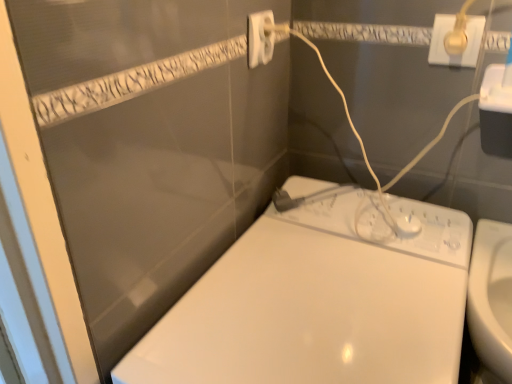
Image resolution: width=512 pixels, height=384 pixels. Describe the element at coordinates (260, 38) in the screenshot. I see `white plastic power plug at upper center, positioned as the first power plugs and sockets in left-to-right order` at that location.

Find the location of a particular element. This screenshot has height=384, width=512. gold metallic plug at upper right, which appears as the first power plugs and sockets when viewed from the right is located at coordinates (456, 40).

Which is more to the left, white glossy toilet at lower right or gold metallic plug at upper right, which is the second power plugs and sockets from left to right?

From the viewer's perspective, white glossy toilet at lower right appears more on the left side.

How many degrees apart are the facing directions of white glossy toilet at lower right and gold metallic plug at upper right, which is the second power plugs and sockets from left to right?

They differ by 10.7 degrees in their facing directions.

The image size is (512, 384). I want to click on the 1st power plugs and sockets located above the white glossy toilet at lower right (from a real-world perspective), so click(456, 40).

Would you say white glossy toilet at lower right contains gold metallic plug at upper right, which is the second power plugs and sockets from left to right?

No.

Between point (259, 25) and point (291, 325), which one is positioned behind?

The point (259, 25) is more distant.

From a real-world perspective, is white plastic power plug at upper center, which appears as the 2th power plugs and sockets when viewed from the right, located beneath white glossy toilet at lower right?

No, from a real-world perspective, white plastic power plug at upper center, which appears as the 2th power plugs and sockets when viewed from the right, is not beneath white glossy toilet at lower right.

Which object is closer to the camera taking this photo, white plastic power plug at upper center, which appears as the 2th power plugs and sockets when viewed from the right, or white glossy toilet at lower right?

white glossy toilet at lower right is in front.

Which of these two, white plastic power plug at upper center, which appears as the 2th power plugs and sockets when viewed from the right, or white glossy toilet at lower right, is bigger?

Bigger between the two is white glossy toilet at lower right.

Is gold metallic plug at upper right, which is the second power plugs and sockets from left to right, touching white glossy toilet at lower right?

No, gold metallic plug at upper right, which is the second power plugs and sockets from left to right, is not touching white glossy toilet at lower right.

Is gold metallic plug at upper right, which is the second power plugs and sockets from left to right, taller than white glossy toilet at lower right?

No.

Which is more to the left, gold metallic plug at upper right, which is the second power plugs and sockets from left to right, or white glossy toilet at lower right?

white glossy toilet at lower right.

Which is closer to the camera, (455, 57) or (465, 284)?

The point (465, 284) is closer to the camera.

Which is more to the left, gold metallic plug at upper right, which is the second power plugs and sockets from left to right, or white plastic power plug at upper center, positioned as the first power plugs and sockets in left-to-right order?

white plastic power plug at upper center, positioned as the first power plugs and sockets in left-to-right order.

From the image's perspective, which is above, gold metallic plug at upper right, which appears as the first power plugs and sockets when viewed from the right, or white plastic power plug at upper center, positioned as the first power plugs and sockets in left-to-right order?

white plastic power plug at upper center, positioned as the first power plugs and sockets in left-to-right order, from the image's perspective.

Does gold metallic plug at upper right, which appears as the first power plugs and sockets when viewed from the right, turn towards white plastic power plug at upper center, which appears as the 2th power plugs and sockets when viewed from the right?

No, gold metallic plug at upper right, which appears as the first power plugs and sockets when viewed from the right, is not facing towards white plastic power plug at upper center, which appears as the 2th power plugs and sockets when viewed from the right.

Does point (451, 30) appear closer or farther from the camera than point (247, 46)?

Clearly, point (451, 30) is more distant from the camera than point (247, 46).

Does white plastic power plug at upper center, positioned as the first power plugs and sockets in left-to-right order, have a lesser width compared to gold metallic plug at upper right, which appears as the first power plugs and sockets when viewed from the right?

Incorrect, the width of white plastic power plug at upper center, positioned as the first power plugs and sockets in left-to-right order, is not less than that of gold metallic plug at upper right, which appears as the first power plugs and sockets when viewed from the right.

Is white plastic power plug at upper center, which appears as the 2th power plugs and sockets when viewed from the right, facing away from gold metallic plug at upper right, which is the second power plugs and sockets from left to right?

That's not correct — white plastic power plug at upper center, which appears as the 2th power plugs and sockets when viewed from the right, is not looking away from gold metallic plug at upper right, which is the second power plugs and sockets from left to right.

From a real-world perspective, is white plastic power plug at upper center, positioned as the first power plugs and sockets in left-to-right order, above or below gold metallic plug at upper right, which appears as the first power plugs and sockets when viewed from the right?

white plastic power plug at upper center, positioned as the first power plugs and sockets in left-to-right order, is above gold metallic plug at upper right, which appears as the first power plugs and sockets when viewed from the right.

Which is in front, point (258, 56) or point (462, 65)?

The point (462, 65) is in front.

From a real-world perspective, is white glossy toilet at lower right physically located above or below white plastic power plug at upper center, positioned as the first power plugs and sockets in left-to-right order?

From a real-world perspective, white glossy toilet at lower right is physically below white plastic power plug at upper center, positioned as the first power plugs and sockets in left-to-right order.

Between point (458, 225) and point (269, 31), which one is positioned in front?

Positioned in front is point (269, 31).

From the picture: Is white glossy toilet at lower right further to camera compared to white plastic power plug at upper center, which appears as the 2th power plugs and sockets when viewed from the right?

No, it is in front of white plastic power plug at upper center, which appears as the 2th power plugs and sockets when viewed from the right.

From the image's perspective, who appears lower, white glossy toilet at lower right or white plastic power plug at upper center, positioned as the first power plugs and sockets in left-to-right order?

From the image's view, white glossy toilet at lower right is below.

This screenshot has width=512, height=384. I want to click on toilet directly beneath the gold metallic plug at upper right, which is the second power plugs and sockets from left to right (from a real-world perspective), so click(x=320, y=301).

Identify the location of power plugs and sockets lying on the left of white glossy toilet at lower right. This screenshot has width=512, height=384. (260, 38).

Looking at the image, which one is located further to white plastic power plug at upper center, which appears as the 2th power plugs and sockets when viewed from the right, white glossy toilet at lower right or gold metallic plug at upper right, which appears as the first power plugs and sockets when viewed from the right?

white glossy toilet at lower right lies further to white plastic power plug at upper center, which appears as the 2th power plugs and sockets when viewed from the right, than the other object.

Based on their spatial positions, is gold metallic plug at upper right, which appears as the first power plugs and sockets when viewed from the right, or white plastic power plug at upper center, positioned as the first power plugs and sockets in left-to-right order, closer to white glossy toilet at lower right?

white plastic power plug at upper center, positioned as the first power plugs and sockets in left-to-right order, is positioned closer to the anchor white glossy toilet at lower right.

From the image, which object appears to be farther from white glossy toilet at lower right, white plastic power plug at upper center, which appears as the 2th power plugs and sockets when viewed from the right, or gold metallic plug at upper right, which appears as the first power plugs and sockets when viewed from the right?

gold metallic plug at upper right, which appears as the first power plugs and sockets when viewed from the right.

Which object lies nearer to the anchor point gold metallic plug at upper right, which is the second power plugs and sockets from left to right, white glossy toilet at lower right or white plastic power plug at upper center, which appears as the 2th power plugs and sockets when viewed from the right?

Among the two, white plastic power plug at upper center, which appears as the 2th power plugs and sockets when viewed from the right, is located nearer to gold metallic plug at upper right, which is the second power plugs and sockets from left to right.

When comparing their distances from gold metallic plug at upper right, which is the second power plugs and sockets from left to right, does white plastic power plug at upper center, which appears as the 2th power plugs and sockets when viewed from the right, or white glossy toilet at lower right seem closer?

white plastic power plug at upper center, which appears as the 2th power plugs and sockets when viewed from the right, is closer to gold metallic plug at upper right, which is the second power plugs and sockets from left to right.

Which object lies nearer to the anchor point white plastic power plug at upper center, positioned as the first power plugs and sockets in left-to-right order, gold metallic plug at upper right, which appears as the first power plugs and sockets when viewed from the right, or white glossy toilet at lower right?

The object closer to white plastic power plug at upper center, positioned as the first power plugs and sockets in left-to-right order, is gold metallic plug at upper right, which appears as the first power plugs and sockets when viewed from the right.

Locate an element on the screen. Image resolution: width=512 pixels, height=384 pixels. power plugs and sockets that lies between white plastic power plug at upper center, which appears as the 2th power plugs and sockets when viewed from the right, and white glossy toilet at lower right from top to bottom is located at coordinates (456, 40).